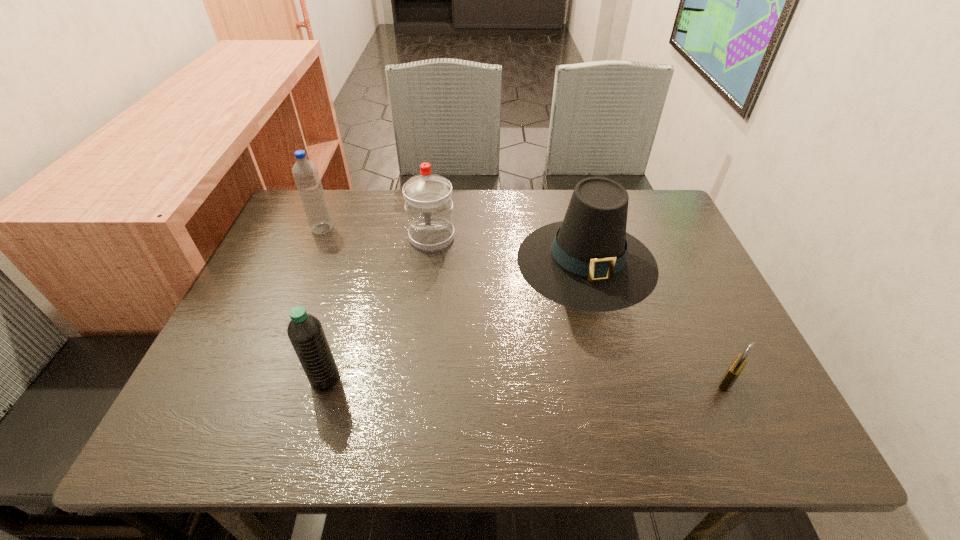
Find the location of a particular element. vacant region located 0.370m on the back of the second water bottle from right to left is located at coordinates (363, 249).

You are a GUI agent. You are given a task and a screenshot of the screen. Output one action in this format:
    pyautogui.click(x=<x>, y=<y>)
    Task: Click on the vacant region located 0.360m on the left of the padlock
    The width and height of the screenshot is (960, 540).
    Given the screenshot: What is the action you would take?
    pyautogui.click(x=536, y=381)

Find the location of `hat that is positioned at the far edge`. hat that is positioned at the far edge is located at coordinates (588, 261).

The image size is (960, 540). In order to click on object located in the left edge section of the desktop in this screenshot , I will do `click(305, 172)`.

Identify the location of hat at the right edge. (588, 261).

The height and width of the screenshot is (540, 960). Identify the location of padlock present at the right edge. (738, 364).

The height and width of the screenshot is (540, 960). I want to click on object that is at the far left corner, so click(x=305, y=172).

In order to click on object present at the far right corner in this screenshot , I will do `click(588, 261)`.

This screenshot has height=540, width=960. I want to click on free spot at the far edge of the desktop, so click(x=513, y=212).

In order to click on vacant region at the near edge of the desktop in this screenshot , I will do `click(538, 442)`.